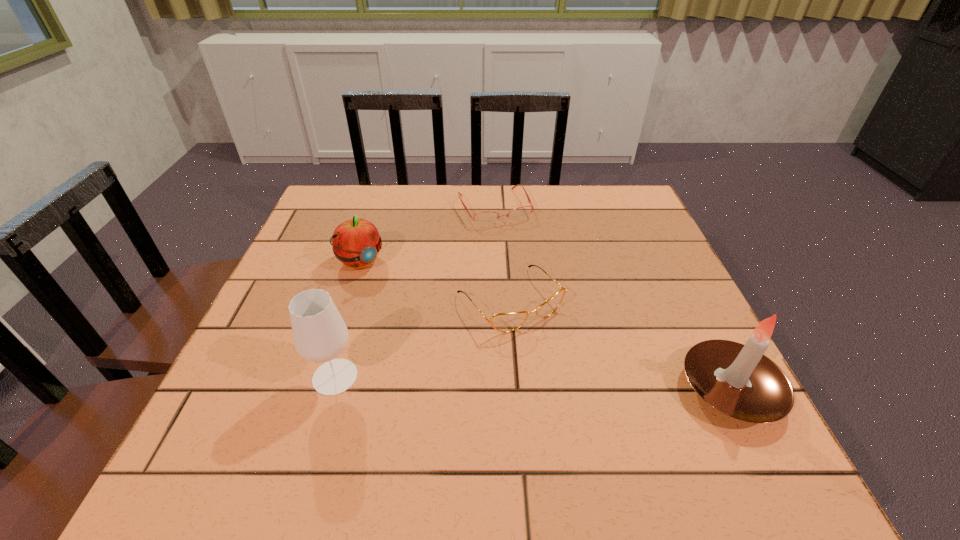
Identify the location of glass. The image size is (960, 540). (320, 334).

Identify the location of the rightmost object. [738, 380].

Find the location of a particular element. Image resolution: width=960 pixels, height=540 pixels. apple is located at coordinates tap(356, 242).

Find the location of a particular element. This screenshot has width=960, height=540. the nearer spectacles is located at coordinates (503, 322).

Identify the location of the second shortest object. The height and width of the screenshot is (540, 960). (503, 322).

Where is `the farther spectacles`? The height and width of the screenshot is (540, 960). the farther spectacles is located at coordinates click(x=483, y=218).

This screenshot has width=960, height=540. In order to click on the farthest object in this screenshot , I will do `click(483, 218)`.

You are a GUI agent. You are given a task and a screenshot of the screen. Output one action in this format:
    pyautogui.click(x=<x>, y=<y>)
    Task: Click on the vacant space located 0.090m on the back of the glass
    This screenshot has height=540, width=960.
    Given the screenshot: What is the action you would take?
    pyautogui.click(x=351, y=324)

Where is `vacant position located 0.370m on the back of the rightmost object`? This screenshot has width=960, height=540. vacant position located 0.370m on the back of the rightmost object is located at coordinates (655, 239).

In order to click on vacant space situated 0.090m on the surface of the apple in this screenshot , I will do `click(393, 294)`.